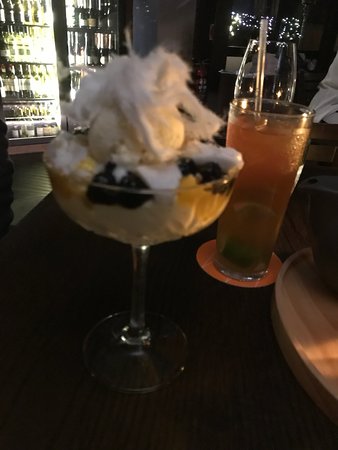
This screenshot has height=450, width=338. Identify the location of stem of wine glass. (143, 259).